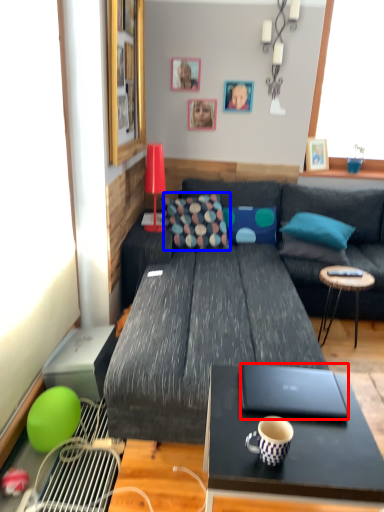
Question: Which point is closer to the camera, laptop (highlighted by a red box) or pillow (highlighted by a blue box)?

Choices:
 (A) laptop
 (B) pillow

Answer: (A)